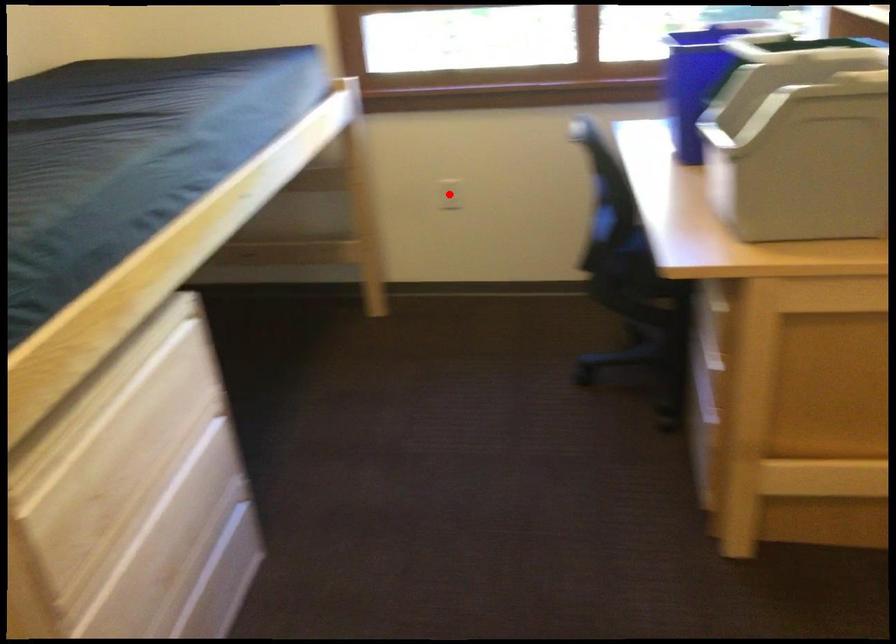
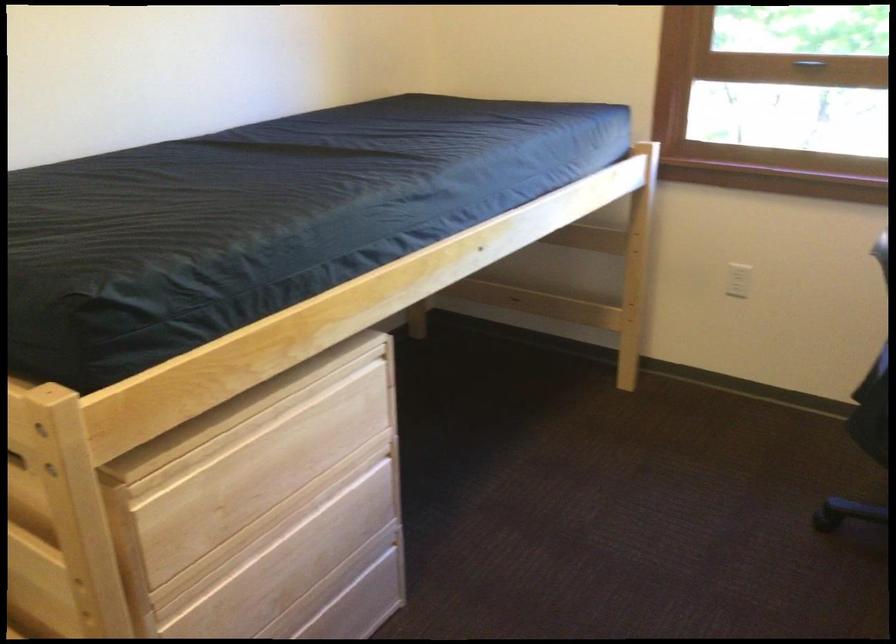
The point at the highlighted location is marked in the first image. Where is the corresponding point in the second image?

(738, 279)